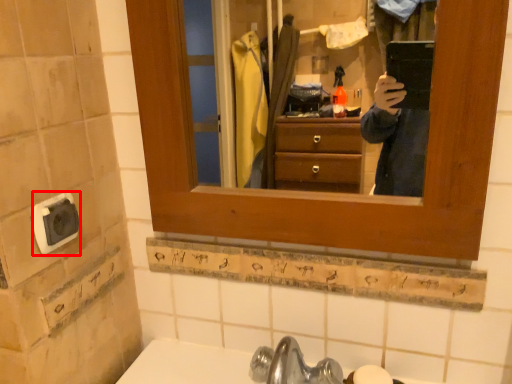
Question: From the image's perspective, what is the correct spatial positioning of knob (annotated by the red box) in reference to soap?

Choices:
 (A) above
 (B) below

Answer: (A)